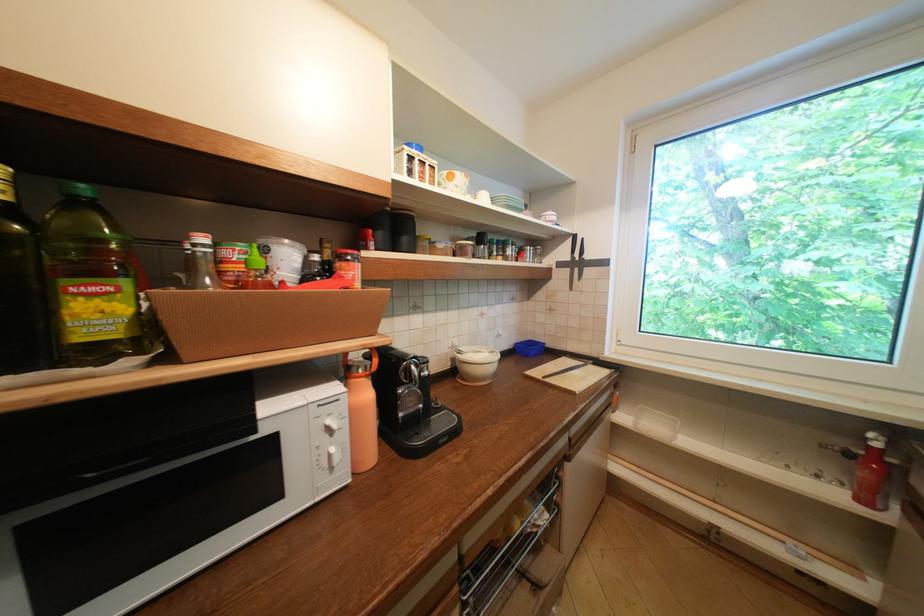
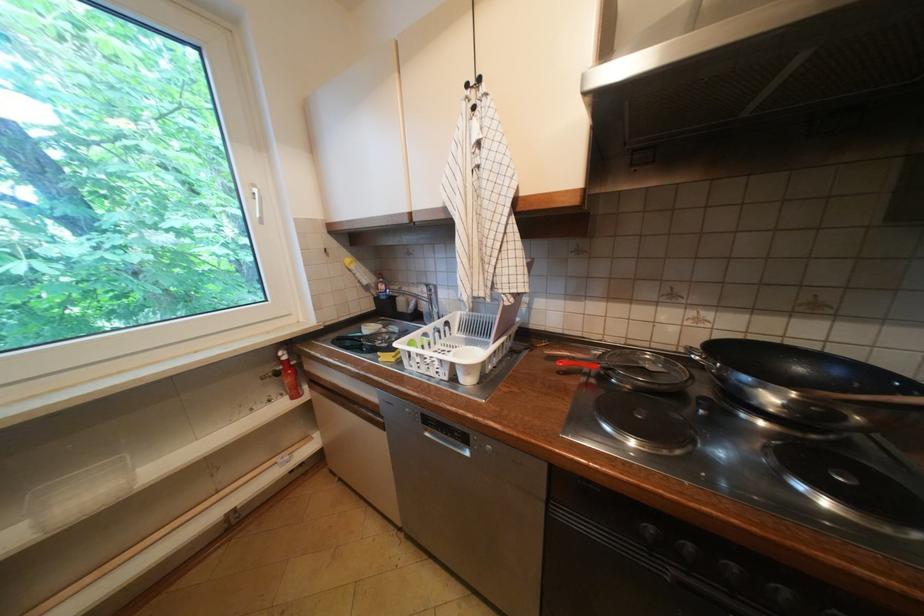
Based on the continuous images, in which direction is the camera rotating?

The rotation direction of the camera is right-down.